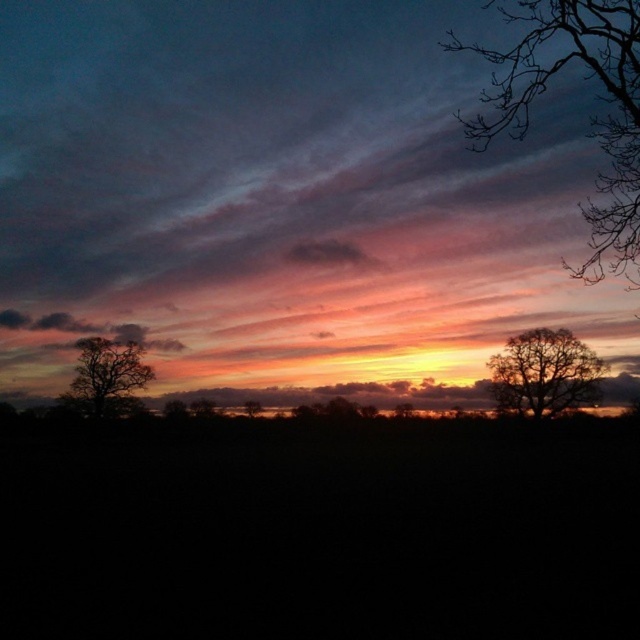
Question: Which point appears farthest from the camera in this image?

Choices:
 (A) (3, 314)
 (B) (248, 410)
 (C) (70, 252)
 (D) (506, 362)

Answer: (A)

Question: Does bare branches at upper right have a lesser width compared to dark gray cloud at left?

Choices:
 (A) yes
 (B) no

Answer: (A)

Question: Is silhouette bare tree at right positioned in front of dark gray cloud at upper center?

Choices:
 (A) no
 (B) yes

Answer: (B)

Question: Which object is farther from the camera taking this photo?

Choices:
 (A) dark gray cloud at upper center
 (B) bare branches at upper right
 (C) silhouette tree at left

Answer: (C)

Question: Is bare branches at upper right smaller than silhouette tree at left?

Choices:
 (A) yes
 (B) no

Answer: (B)

Question: Considering the real-world distances, which object is closest to the dark gray cloud at left?

Choices:
 (A) silhouette tree at center
 (B) silhouette tree at left
 (C) silhouette bare tree at right
 (D) matte pink cloud at center

Answer: (B)